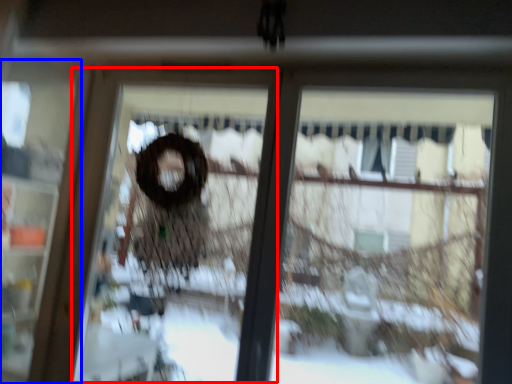
Question: Among these objects, which one is nearest to the camera, screen door (highlighted by a red box) or screen door (highlighted by a blue box)?

Choices:
 (A) screen door
 (B) screen door

Answer: (A)